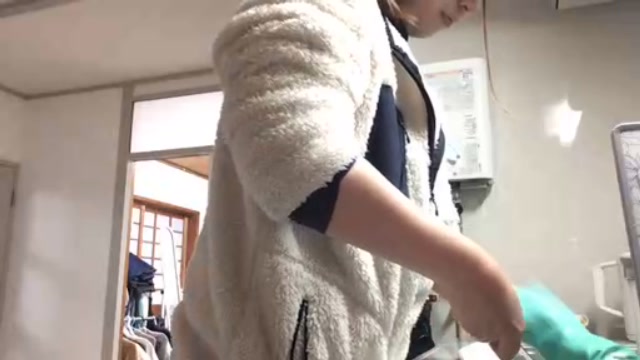
The image size is (640, 360). Identify the location of ceiling. (52, 33), (172, 45).